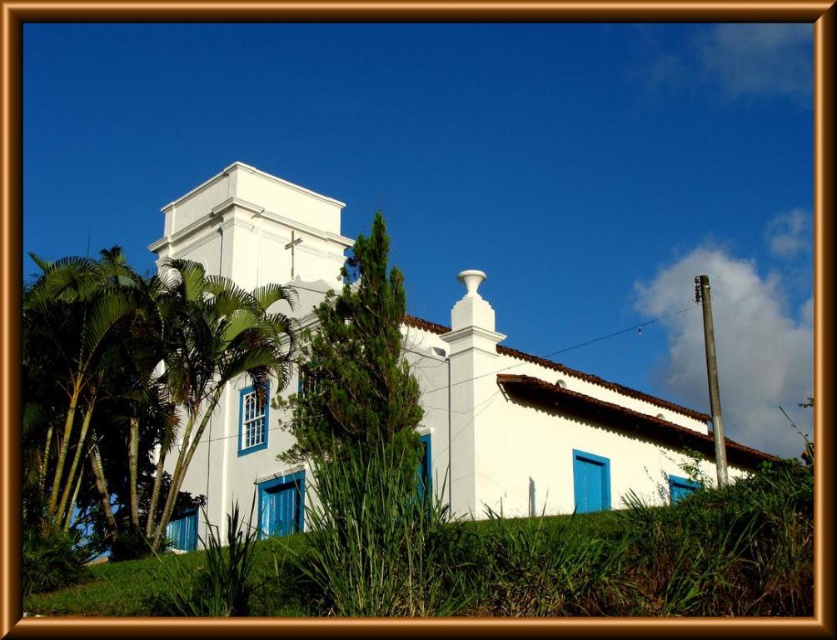
Who is more forward, (476,436) or (168,349)?

Point (476,436) is in front.

Locate an element on the screen. This screenshot has height=640, width=837. white stucco church at center is located at coordinates (540, 426).

Locate an element on the screen. white stucco church at center is located at coordinates (540, 426).